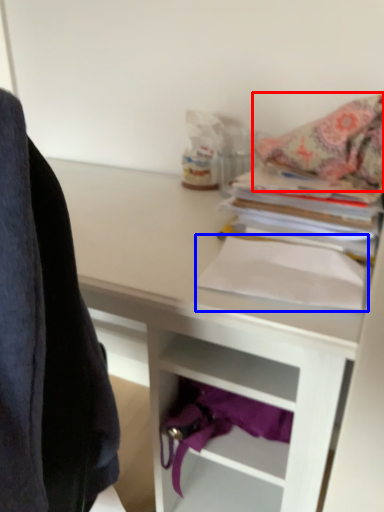
Question: Among these objects, which one is nearest to the camera, blanket (highlighted by a red box) or paperback book (highlighted by a blue box)?

Choices:
 (A) blanket
 (B) paperback book

Answer: (B)